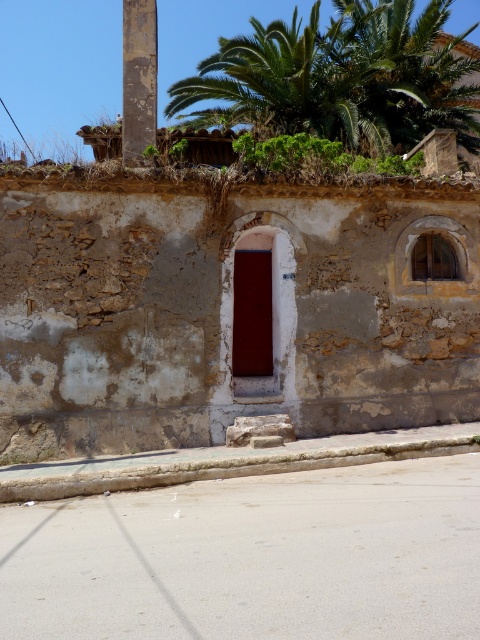
Is green leafy palm tree at upper center smaller than rusty metal pole at upper left?

Incorrect, green leafy palm tree at upper center is not smaller in size than rusty metal pole at upper left.

Which is more to the right, green leafy palm tree at upper center or rusty metal pole at upper left?

green leafy palm tree at upper center

This screenshot has width=480, height=640. In order to click on green leafy palm tree at upper center in this screenshot , I will do `click(339, 77)`.

From the picture: Can you confirm if green leafy palm tree at upper center is taller than green leafy plant at upper center?

Yes.

Who is taller, green leafy palm tree at upper center or green leafy plant at upper center?

green leafy palm tree at upper center is taller.

Which is in front, point (350, 20) or point (418, 156)?

Point (418, 156) is more forward.

This screenshot has height=640, width=480. I want to click on green leafy palm tree at upper center, so click(339, 77).

Which is below, rusty metal pole at upper left or green leafy plant at upper center?

Positioned lower is rusty metal pole at upper left.

Who is positioned more to the right, rusty metal pole at upper left or green leafy plant at upper center?

From the viewer's perspective, green leafy plant at upper center appears more on the right side.

Which is in front, point (134, 97) or point (333, 168)?

Point (333, 168) is more forward.

I want to click on rusty metal pole at upper left, so (139, 80).